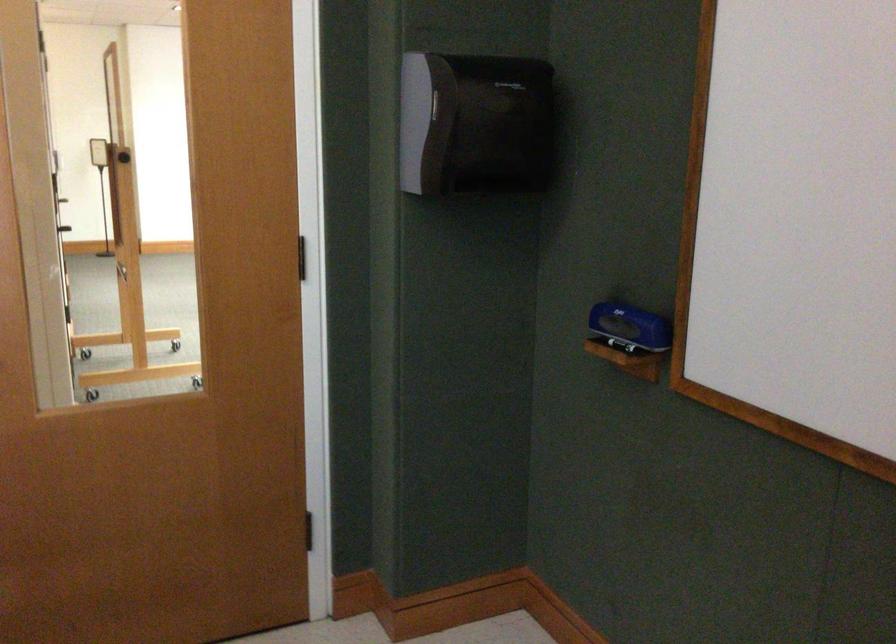
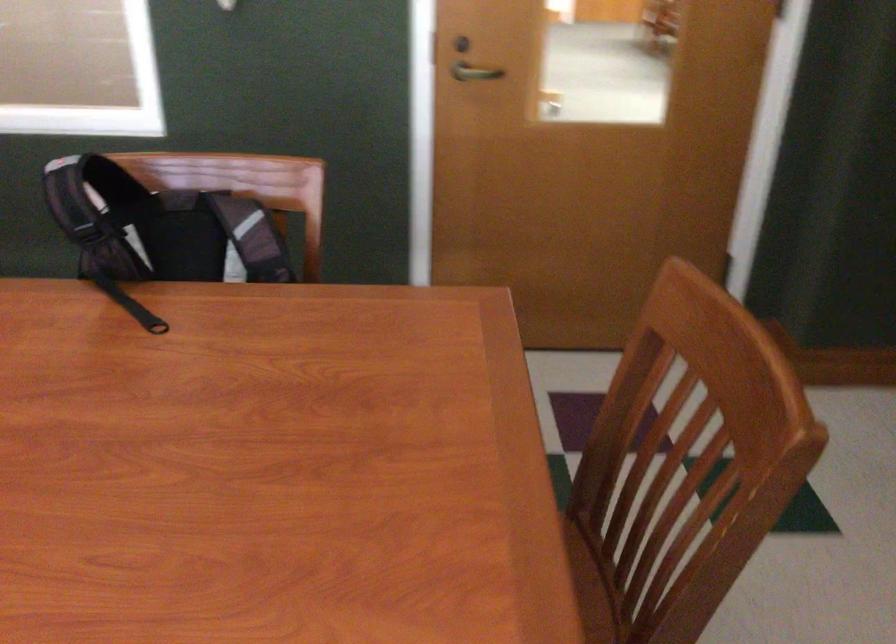
Which direction would the cameraman need to move to produce the second image?

The movement direction of the cameraman is left, backward.